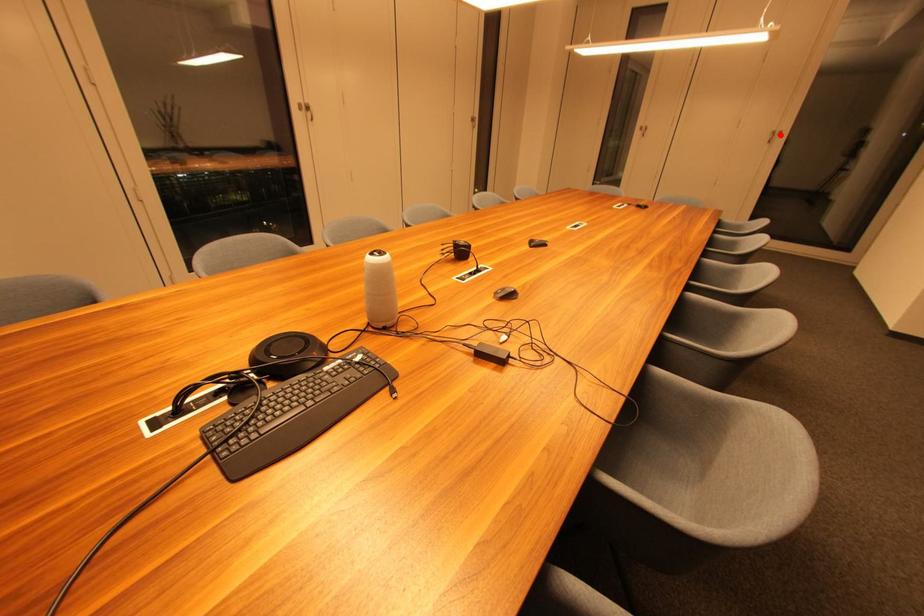
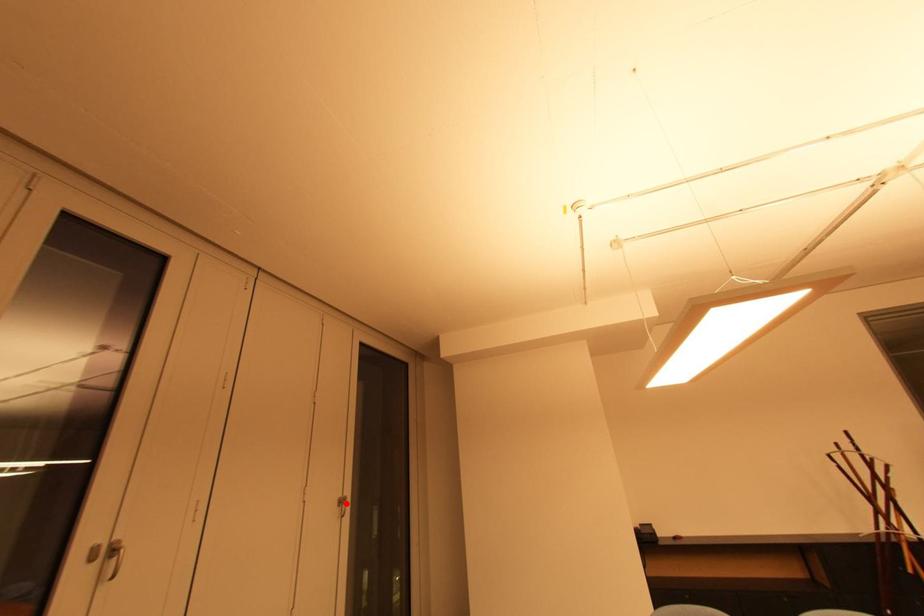
I am providing you with two images of the same scene from different viewpoints. A red point is marked on the first image and another point is marked on the second image. Is the red point in image1 aligned with the point shown in image2?

Yes